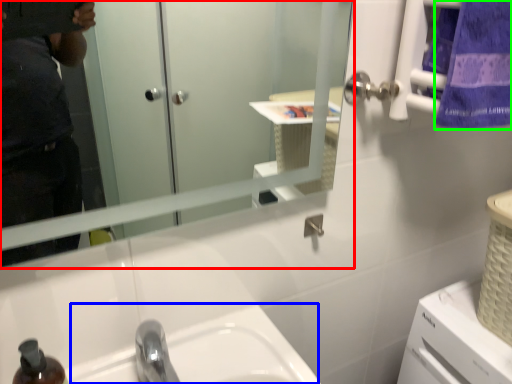
Question: Based on their relative distances, which object is nearer to mirror (highlighted by a red box)? Choose from sink (highlighted by a blue box) and towel/napkin (highlighted by a green box).

Choices:
 (A) sink
 (B) towel/napkin

Answer: (B)